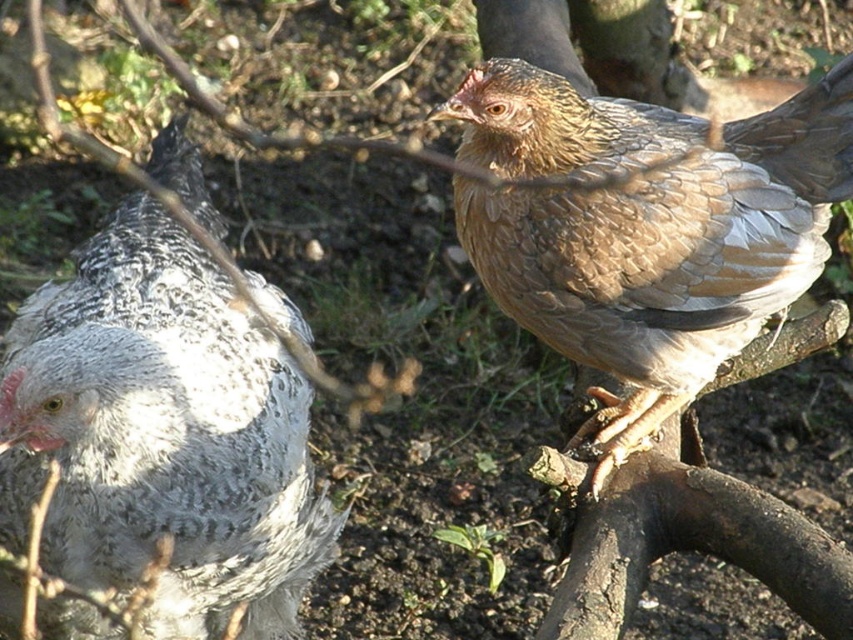
Between point (158, 339) and point (666, 116), which one is positioned in front?

Point (158, 339)

Is speckled feathered chicken at left wider than brown feathered chicken at upper right?

In fact, speckled feathered chicken at left might be narrower than brown feathered chicken at upper right.

Identify the location of speckled feathered chicken at left. (161, 435).